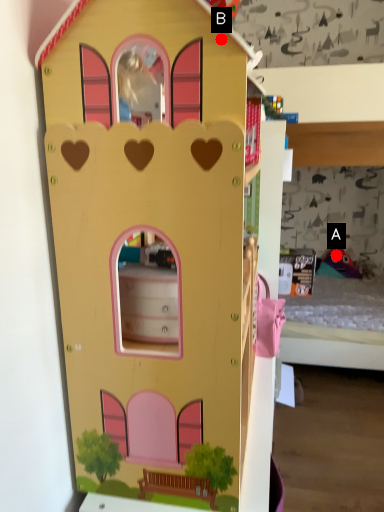
Question: Two points are circled on the image, labeled by A and B beside each circle. Which of the following is the farthest from the observer?

Choices:
 (A) A is further
 (B) B is further

Answer: (A)